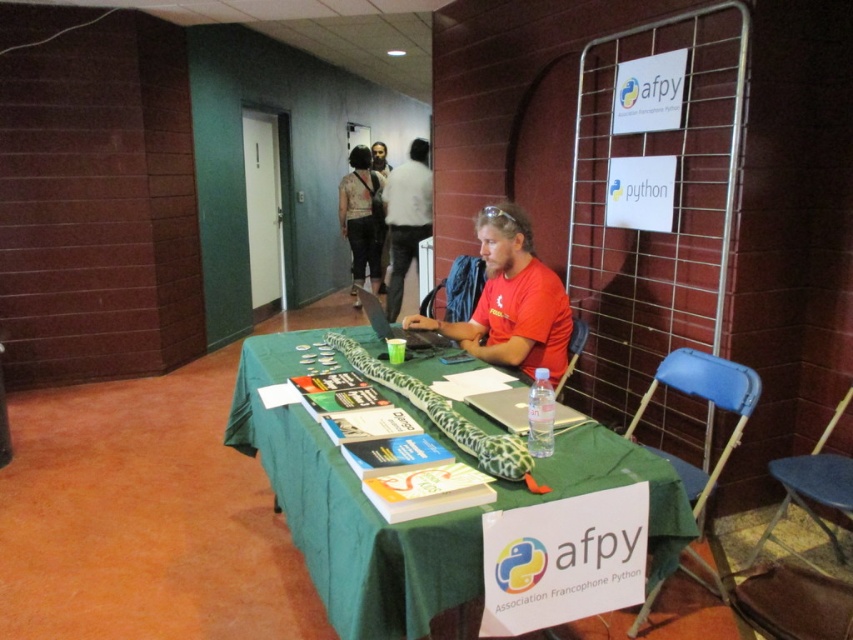
Locate an element on the screen. green fabric table at center is located at coordinates (347, 509).

Locate an element on the screen. matte red t-shirt at center is located at coordinates (511, 301).

This screenshot has width=853, height=640. What do you see at coordinates (511, 301) in the screenshot?
I see `matte red t-shirt at center` at bounding box center [511, 301].

Find the location of a particular element. matte red t-shirt at center is located at coordinates (511, 301).

Describe the element at coordinates (405, 218) in the screenshot. I see `white matte shirt at center` at that location.

Which is in front, point (393, 305) or point (361, 266)?

Point (393, 305) is in front.

Locate an element on the screen. Image resolution: width=853 pixels, height=640 pixels. white matte shirt at center is located at coordinates (405, 218).